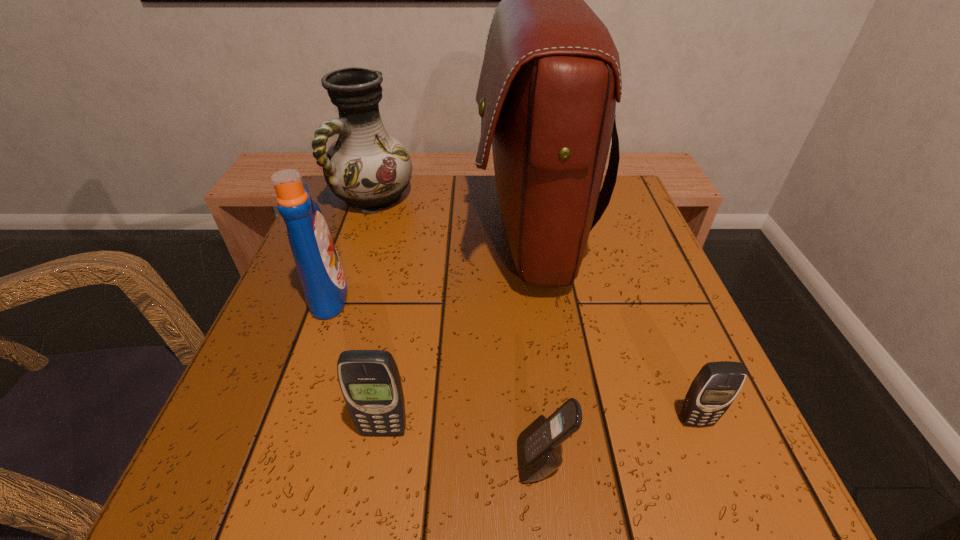
In order to click on satchel in this screenshot , I will do click(x=550, y=78).

I want to click on vase, so click(368, 169).

Locate an element on the screen. This screenshot has height=540, width=960. detergent is located at coordinates (319, 268).

I want to click on the leftmost cellular telephone, so click(x=369, y=380).

The image size is (960, 540). Identify the location of the tallest cellular telephone. (369, 380).

This screenshot has height=540, width=960. Find the location of `the rightmost object`. the rightmost object is located at coordinates (713, 390).

This screenshot has height=540, width=960. What are the coordinates of `the nearest object` in the screenshot? It's located at (539, 453).

Where is `the nearest cellular telephone`? the nearest cellular telephone is located at coordinates (539, 453).

Locate an element on the screen. This screenshot has width=960, height=540. vacant area situated 0.290m on the open flap of the satchel is located at coordinates (345, 234).

Where is `blank space located on the open flap of the satchel`? The width and height of the screenshot is (960, 540). blank space located on the open flap of the satchel is located at coordinates (395, 234).